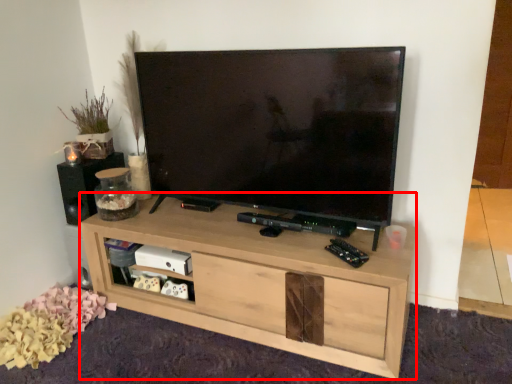
Question: In this image, where is shelf (annotated by the red box) located relative to speaker?

Choices:
 (A) left
 (B) right

Answer: (B)